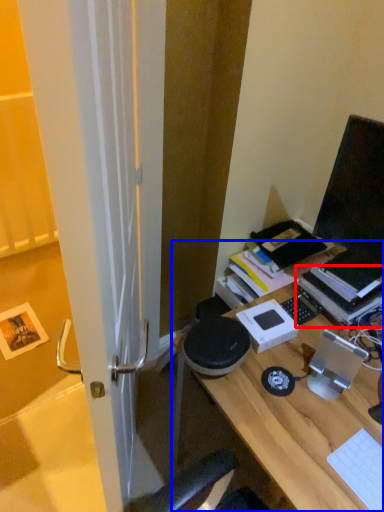
Question: Which point is further to the camera, paperback book (highlighted by a red box) or desk (highlighted by a blue box)?

Choices:
 (A) paperback book
 (B) desk

Answer: (A)